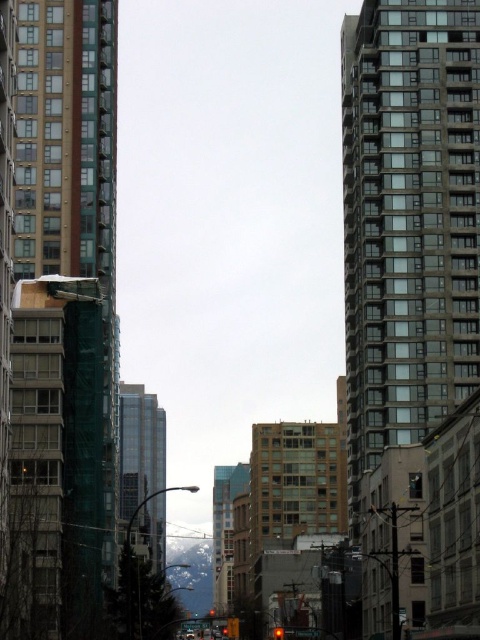
Question: Which point appears closest to the camera in this image?

Choices:
 (A) (384, 406)
 (B) (110, 284)
 (C) (155, 568)

Answer: (A)

Question: Does green glass building at left appear on the left side of glassy reflective building at center?

Choices:
 (A) no
 (B) yes

Answer: (A)

Question: Which object is farther from the camera taking this photo?

Choices:
 (A) green glass building at left
 (B) gray concrete building at center
 (C) glassy reflective building at center

Answer: (C)

Question: Can you confirm if green glass building at left is positioned to the left of glassy reflective building at center?

Choices:
 (A) no
 (B) yes

Answer: (A)

Question: Does gray concrete building at center have a greater width compared to glassy reflective building at center?

Choices:
 (A) no
 (B) yes

Answer: (A)

Question: Which of the following is the closest to the observer?

Choices:
 (A) (108, 141)
 (B) (147, 435)
 (C) (472, 60)

Answer: (C)